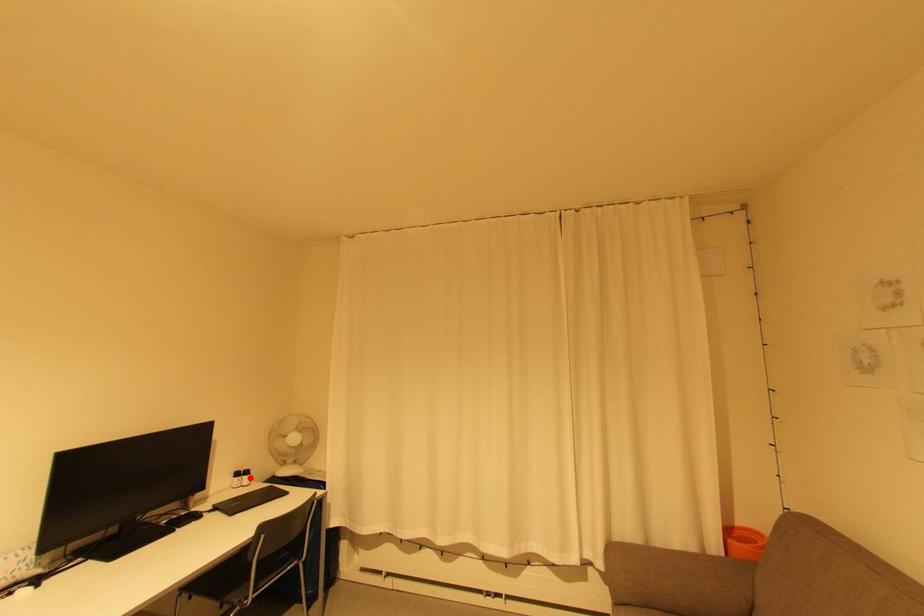
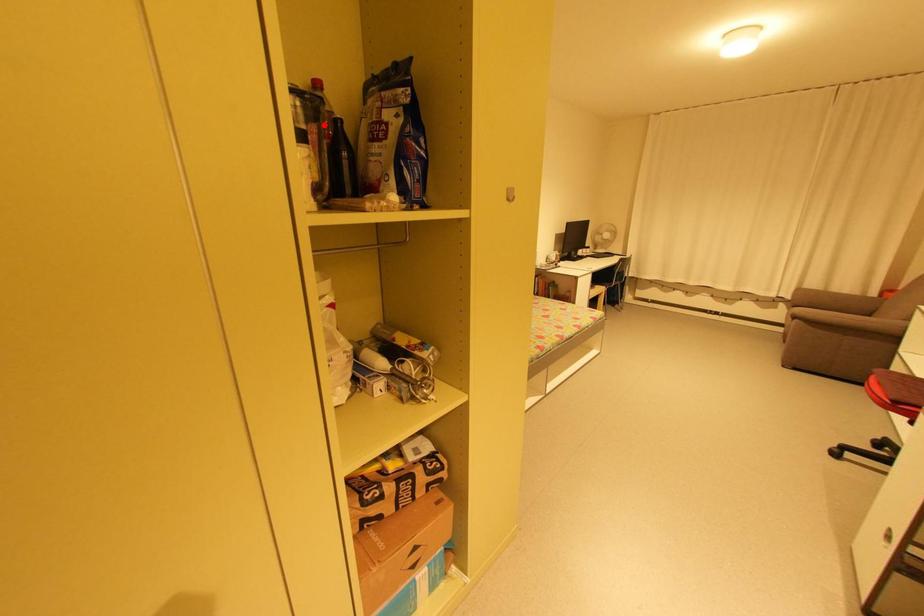
I am providing you with two images of the same scene from different viewpoints. A red point is marked on the first image and another point is marked on the second image. Is the marked point in image1 the same physical position as the marked point in image2?

No